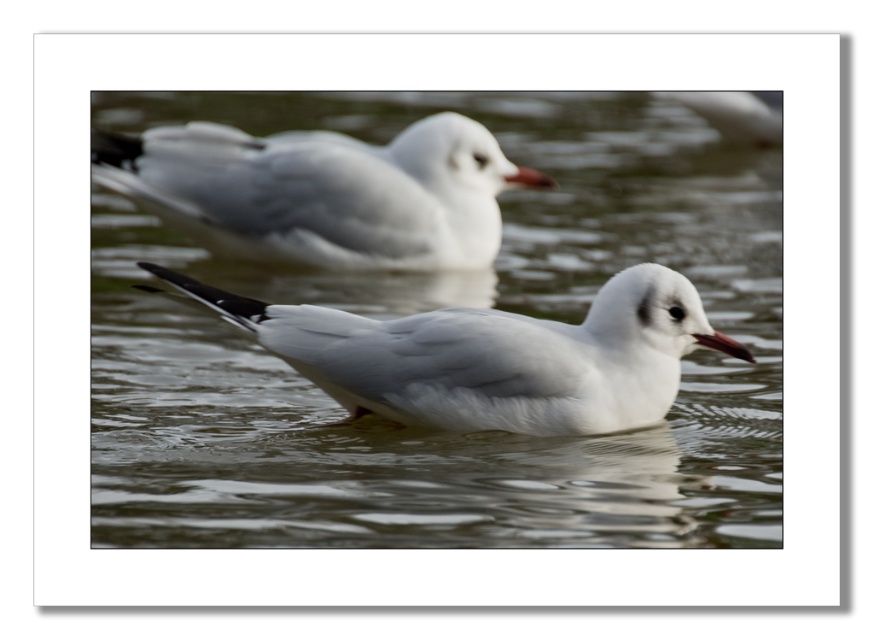
Question: Does clear water at center come behind white matte bird at upper center?

Choices:
 (A) no
 (B) yes

Answer: (B)

Question: Is clear water at center to the left of white matte bird at center from the viewer's perspective?

Choices:
 (A) yes
 (B) no

Answer: (A)

Question: Which of the following is the closest to the observer?

Choices:
 (A) (551, 180)
 (B) (372, 380)

Answer: (B)

Question: Is clear water at center positioned behind white matte bird at center?

Choices:
 (A) no
 (B) yes

Answer: (B)

Question: Which of the following is the farthest from the observer?

Choices:
 (A) clear water at center
 (B) white matte bird at upper center
 (C) matte red beak at center

Answer: (A)

Question: Which object appears farthest from the camera in this image?

Choices:
 (A) matte red beak at center
 (B) white matte bird at center
 (C) clear water at center

Answer: (C)